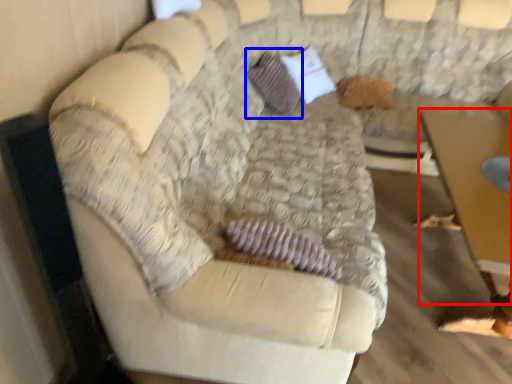
Question: Which object appears farthest to the camera in this image, table (highlighted by a red box) or pillow (highlighted by a blue box)?

Choices:
 (A) table
 (B) pillow

Answer: (B)